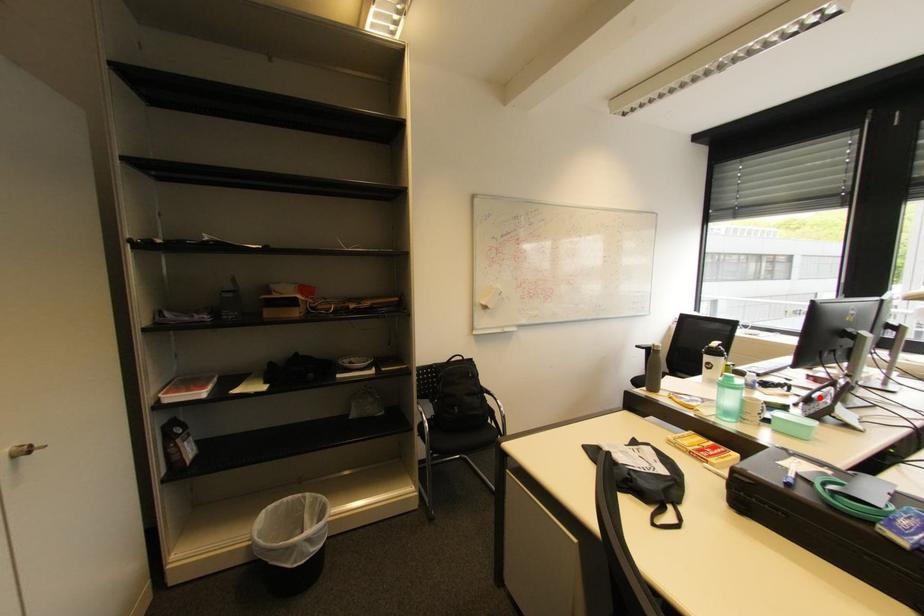
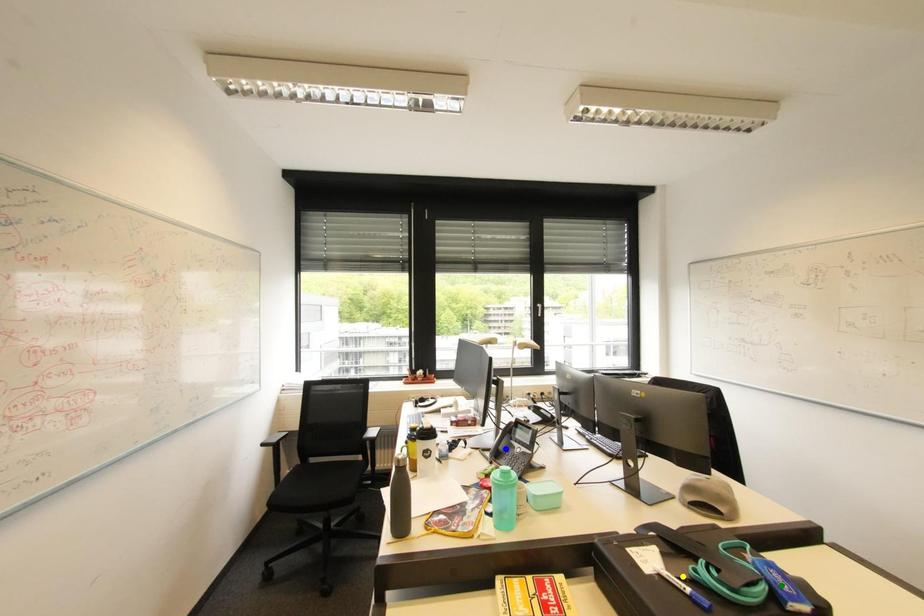
Question: I am providing you with two images of the same scene from different viewpoints. A red point is marked on the first image. You are given multiple points on the second image. Which spot in image 2 lines up with the point in image 1?

Choices:
 (A) green point
 (B) blue point
 (C) yellow point

Answer: (B)